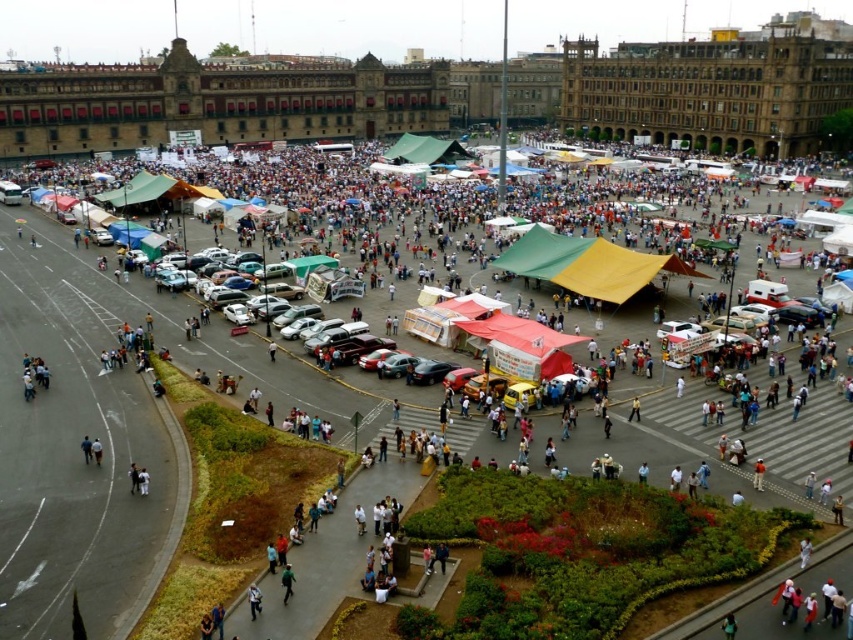
Who is shorter, green canvas tent at center or green fabric canopy at lower left?

green fabric canopy at lower left

Looking at this image, does green canvas tent at center come in front of green fabric canopy at lower left?

No, green canvas tent at center is further to the viewer.

Measure the distance between point (422, 145) and camera.

Point (422, 145) and camera are 594.55 feet apart.

Where is `green canvas tent at center`? This screenshot has width=853, height=640. green canvas tent at center is located at coordinates point(424,148).

Is green/yellow fabric tent at center thinner than green fabric canopy at lower left?

Incorrect, green/yellow fabric tent at center's width is not less than green fabric canopy at lower left's.

Is green/yellow fabric tent at center further to the viewer compared to green fabric canopy at lower left?

No, it is not.

Which is behind, point (550, 260) or point (125, 204)?

Point (125, 204)

This screenshot has height=640, width=853. I want to click on green/yellow fabric tent at center, so click(587, 264).

Does green/yellow fabric tent at center have a greater width compared to green canvas tent at center?

Yes.

At what (x,y) coordinates should I click in order to perform the action: click on green/yellow fabric tent at center. Please return your answer as a coordinate pair (x, y). Looking at the image, I should click on (587, 264).